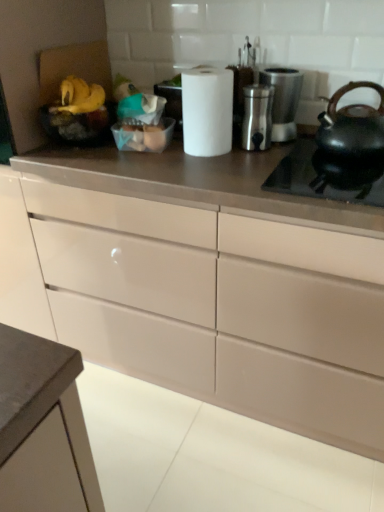
Image resolution: width=384 pixels, height=512 pixels. I want to click on vacant space in front of matte black kettle at right, so (x=340, y=175).